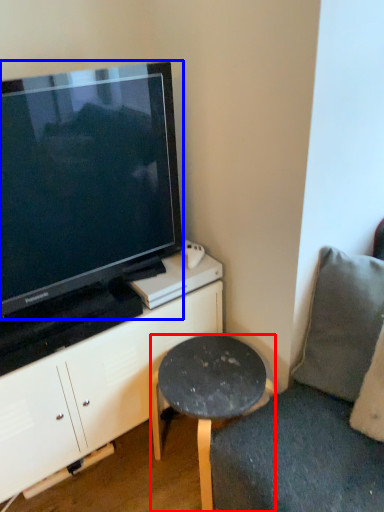
Question: Which of the following is the closest to the observer, stool (highlighted by a red box) or television (highlighted by a blue box)?

Choices:
 (A) stool
 (B) television

Answer: (B)